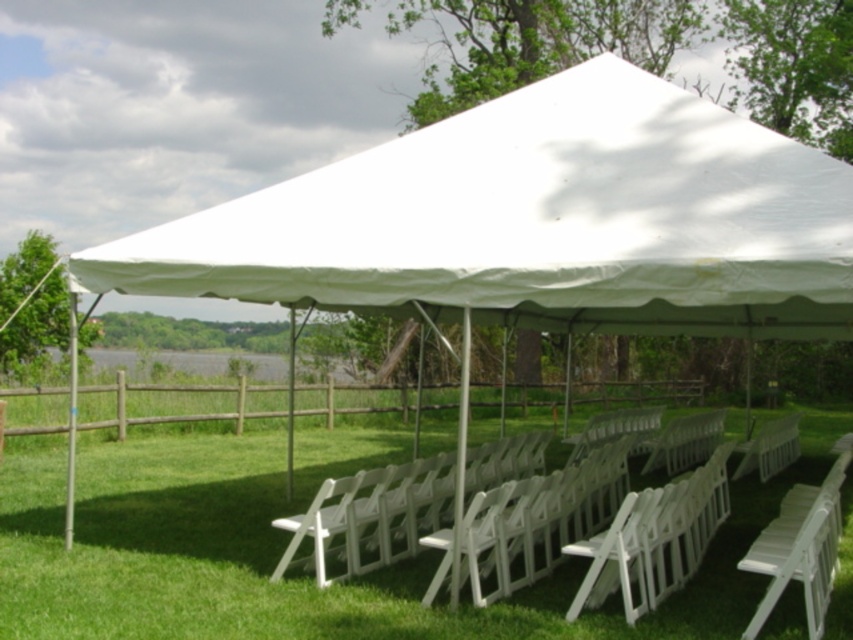
Is point (671, 497) positioned after point (753, 464)?

No, it is not.

From the picture: Can you confirm if white plastic chairs at center is positioned to the right of white plastic chair at center?

In fact, white plastic chairs at center is to the left of white plastic chair at center.

Between point (486, 502) and point (741, 445), which one is positioned in front?

Positioned in front is point (486, 502).

Identify the location of white plastic chairs at center. (654, 540).